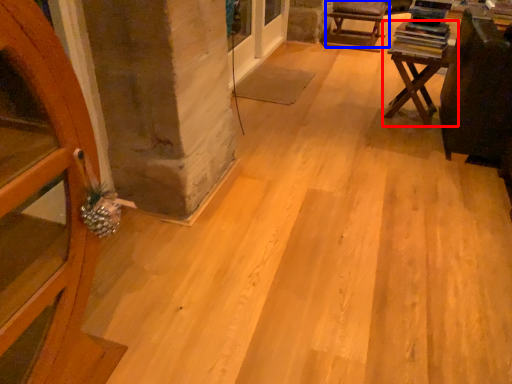
Question: Which object appears closest to the camera in this image, table (highlighted by a red box) or armchair (highlighted by a blue box)?

Choices:
 (A) table
 (B) armchair

Answer: (A)